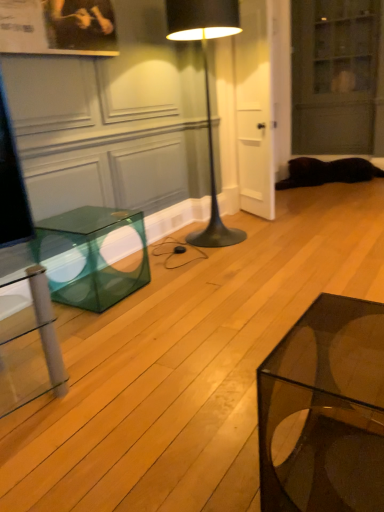
This screenshot has height=512, width=384. In order to click on vacant area located to the right-hand side of black metal floor lamp at center in this screenshot , I will do `click(278, 236)`.